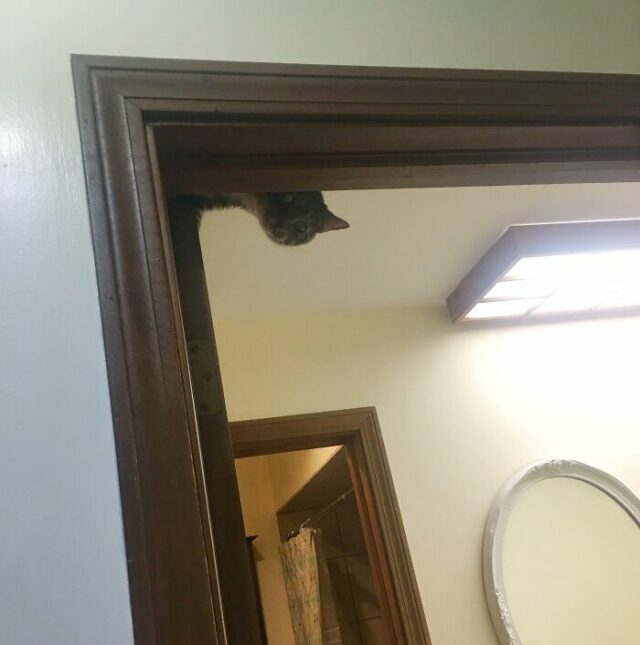
Where is `top of inner door frame`? top of inner door frame is located at coordinates (304, 427).